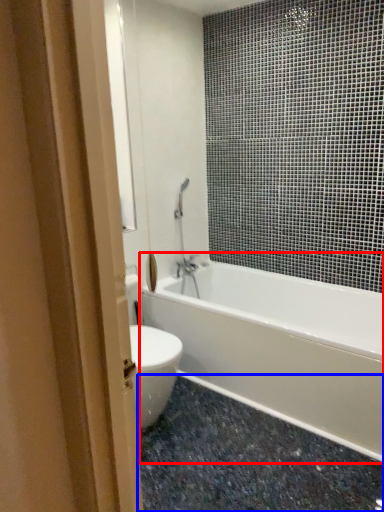
Question: Which point is further to the camera, bathtub (highlighted by a red box) or granite (highlighted by a blue box)?

Choices:
 (A) bathtub
 (B) granite

Answer: (A)